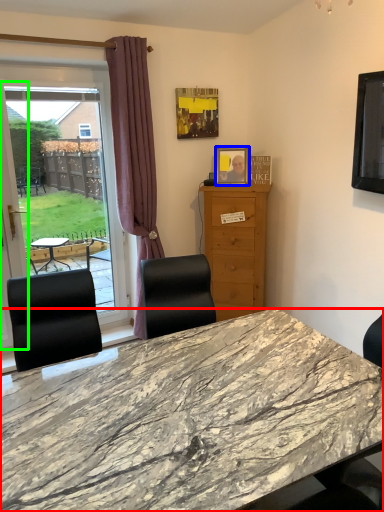
Question: Estimate the real-world distances between objects in this image. Which object is closer to desk (highlighted by a red box), picture frame (highlighted by a blue box) or screen door (highlighted by a green box)?

Choices:
 (A) picture frame
 (B) screen door

Answer: (B)